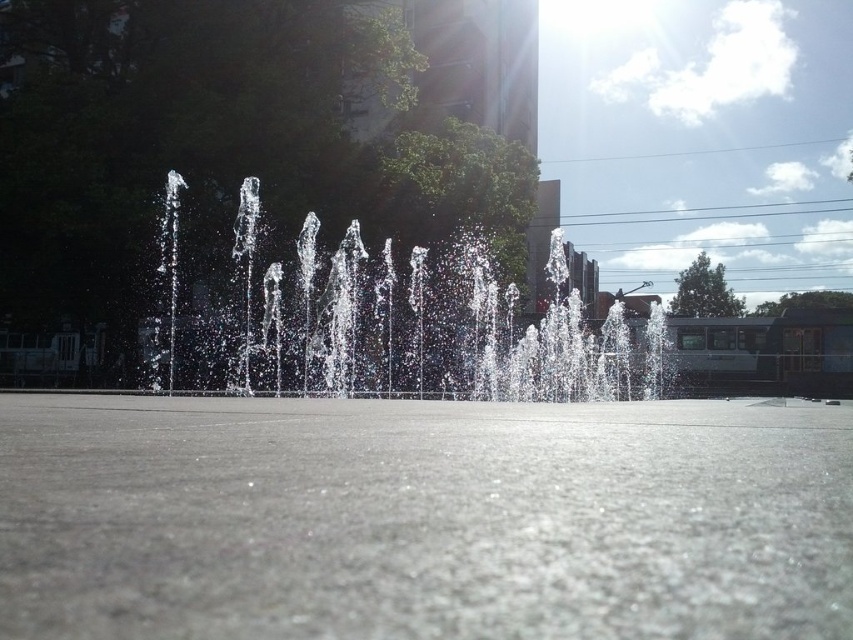
You are standing in front of the fountain and want to take a photo of the transparent liquid water at center and clear water at center. Which one should you focus on first if you want to capture both clearly in the same frame?

You should focus on the transparent liquid water at center first because it is closer to the viewer than the clear water at center, so adjusting focus from near to far will help capture both clearly.

You are standing in front of the fountain and want to know which water is on the left side between the transparent liquid water at center and the clear water at center. Can you tell me?

The transparent liquid water at center is positioned on the left side of clear water at center.

You are standing in the vibrant outdoor scene with the fountain. You notice two points marked in the image. The first point is at coordinate point (737, 508) and the second is at point (171, 333). Which point is nearer to you?

Point (737, 508) is closer to the viewer than point (171, 333).